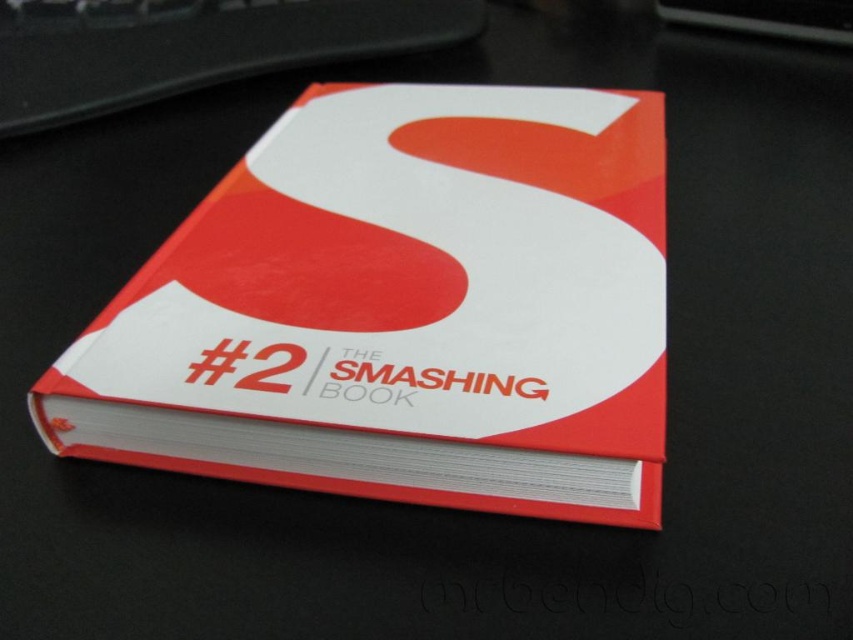
Question: Is matte hardcover book at center below black plastic keyboard at upper center?

Choices:
 (A) no
 (B) yes

Answer: (B)

Question: Among these points, which one is farthest from the camera?

Choices:
 (A) (50, 72)
 (B) (244, 234)

Answer: (A)

Question: Is matte hardcover book at center positioned before black plastic keyboard at upper center?

Choices:
 (A) yes
 (B) no

Answer: (A)

Question: Which point appears closest to the camera in this image?

Choices:
 (A) 55,28
 (B) 529,420

Answer: (B)

Question: Is the position of matte hardcover book at center more distant than that of black plastic keyboard at upper center?

Choices:
 (A) yes
 (B) no

Answer: (B)